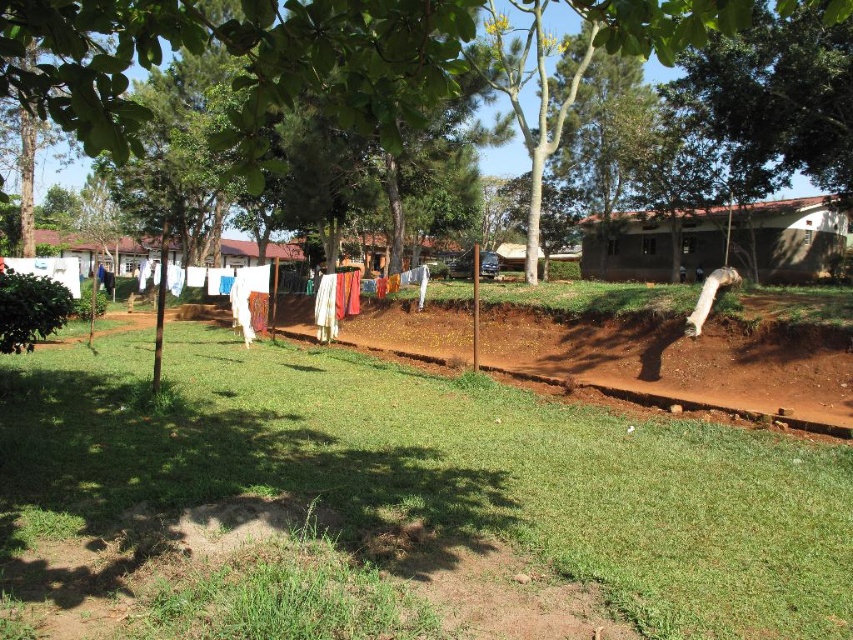
Between green grass at center and green leafy tree at center, which one appears on the left side from the viewer's perspective?

Positioned to the left is green grass at center.

Which is above, green grass at center or green leafy tree at center?

green leafy tree at center is higher up.

You are a GUI agent. You are given a task and a screenshot of the screen. Output one action in this format:
    pyautogui.click(x=<x>, y=<y>)
    Task: Click on the green grass at center
    The width and height of the screenshot is (853, 640).
    Given the screenshot: What is the action you would take?
    pyautogui.click(x=393, y=506)

Image resolution: width=853 pixels, height=640 pixels. What are the coordinates of `green grass at center` in the screenshot? It's located at (393, 506).